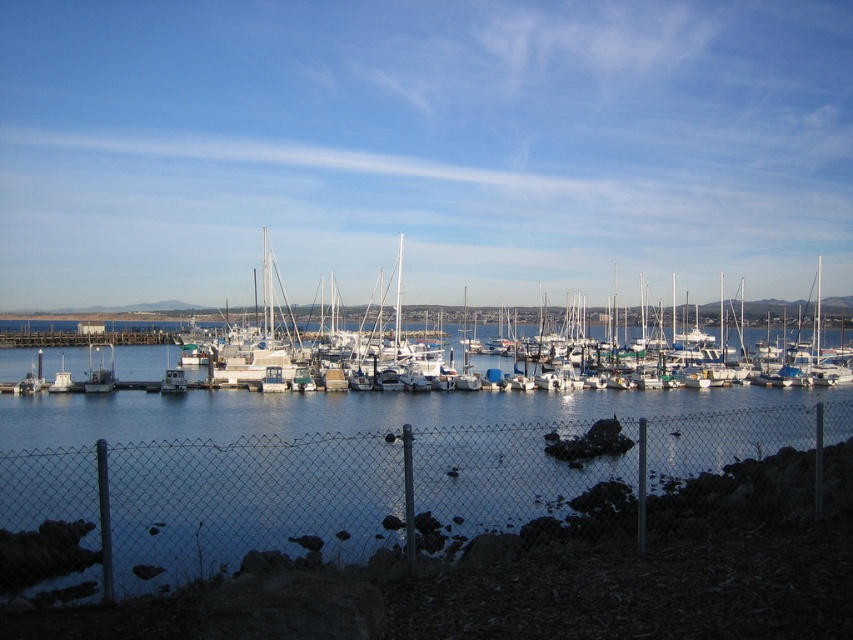
You are standing at the fence and want to board a boat. Which boat, the metallic gray boat at left or the white matte boat at left, is easier to reach from your current position?

The metallic gray boat at left is closer to the viewer than the white matte boat at left, so it is easier to reach from your current position at the fence.

You are a photographer planning to take a photo of the metallic gray boat at left and the white matte boat at left from the fence. Which boat will appear taller in the photo?

The metallic gray boat at left will appear taller in the photo because it is taller than the white matte boat at left.